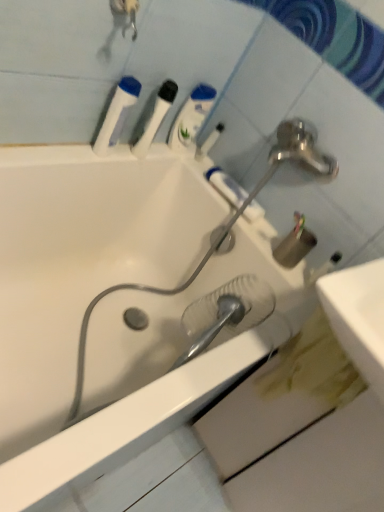
Locate an element on the screen. Image resolution: width=384 pixels, height=512 pixels. vacant area that is in front of white plastic bottle at upper left, which is counted as the first mouthwash, starting from the left is located at coordinates (60, 152).